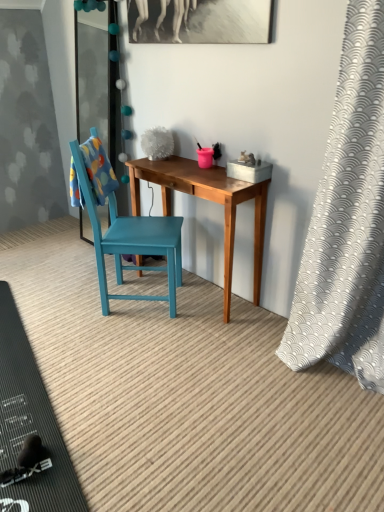
The width and height of the screenshot is (384, 512). I want to click on free space in front of wooden desk at center, so click(x=187, y=346).